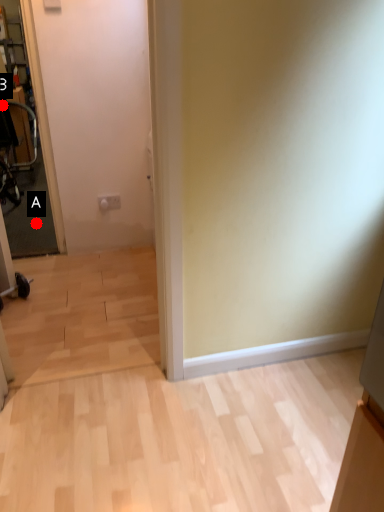
Question: Two points are circled on the image, labeled by A and B beside each circle. Which point is further to the camera?

Choices:
 (A) A is further
 (B) B is further

Answer: (B)